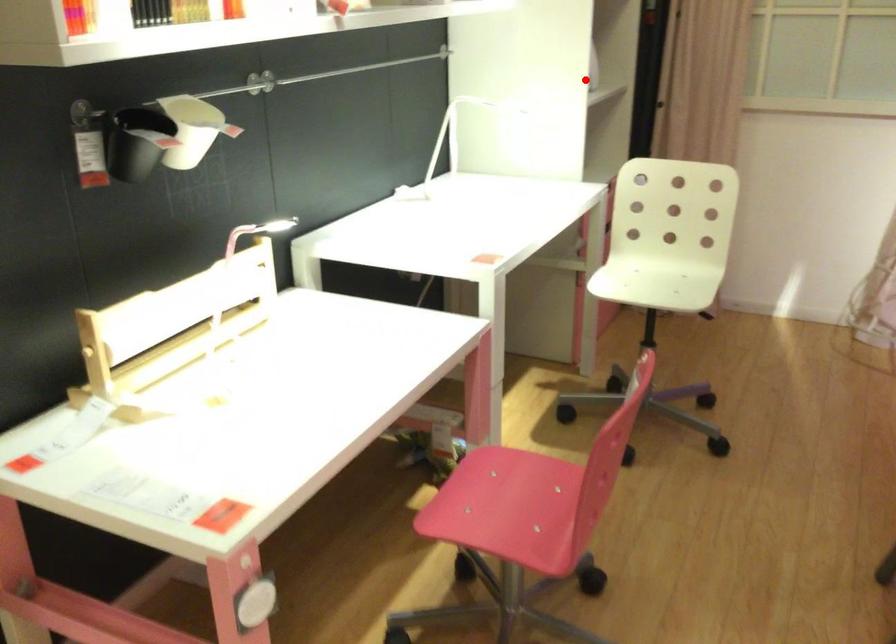
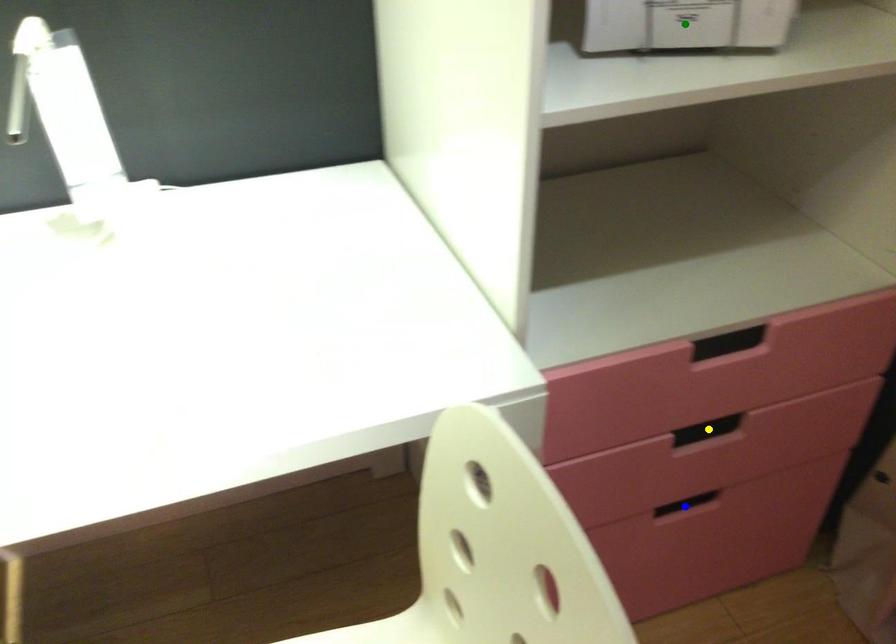
Question: I am providing you with two images of the same scene from different viewpoints. A red point is marked on the first image. You are given multiple points on the second image. Can you choose the point in image 2 that corresponds to the point in image 1?

Choices:
 (A) green point
 (B) yellow point
 (C) blue point

Answer: (A)